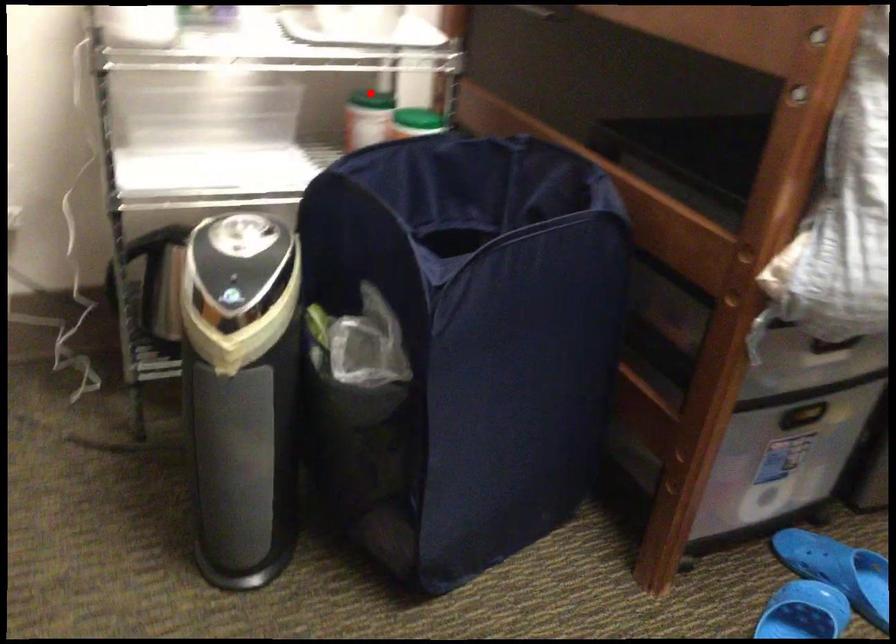
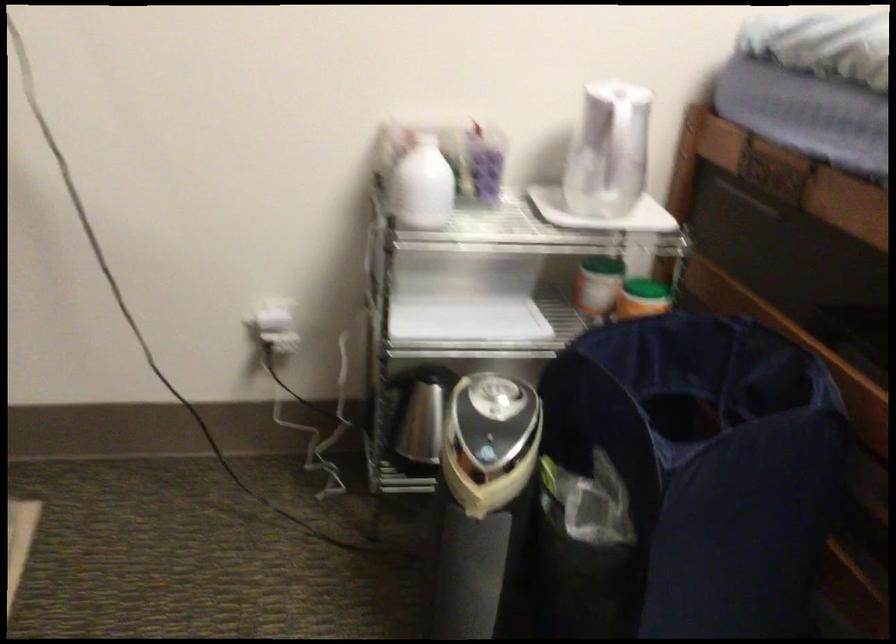
Question: I am providing you with two images of the same scene from different viewpoints. Image1 has a red point marked. In image2, the corresponding 3D location appears at what relative position? Reply with the corresponding letter.

Choices:
 (A) Closer
 (B) Farther

Answer: (B)